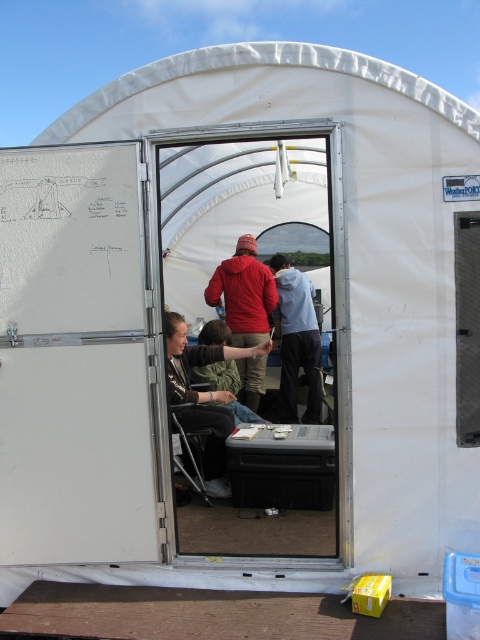
Does point (253, 276) come behind point (317, 339)?

No, (253, 276) is in front of (317, 339).

Does point (260, 300) come closer to viewer compared to point (314, 392)?

That is True.

Describe the element at coordinates (243, 292) in the screenshot. This screenshot has width=480, height=640. I see `matte red jacket at center` at that location.

Where is `matte red jacket at center`? matte red jacket at center is located at coordinates (243, 292).

Which is behind, point (242, 282) or point (226, 353)?

The point (242, 282) is behind.

Find the location of `transparent plastic screen door at center`. transparent plastic screen door at center is located at coordinates (255, 321).

Is white matte door at center thinner than matte red jacket at center?

In fact, white matte door at center might be wider than matte red jacket at center.

Between white matte door at center and matte red jacket at center, which one is positioned higher?

matte red jacket at center is higher up.

Locate an element on the screen. This screenshot has height=640, width=480. white matte door at center is located at coordinates (75, 358).

What are the coordinates of `white matte door at center` in the screenshot? It's located at (75, 358).